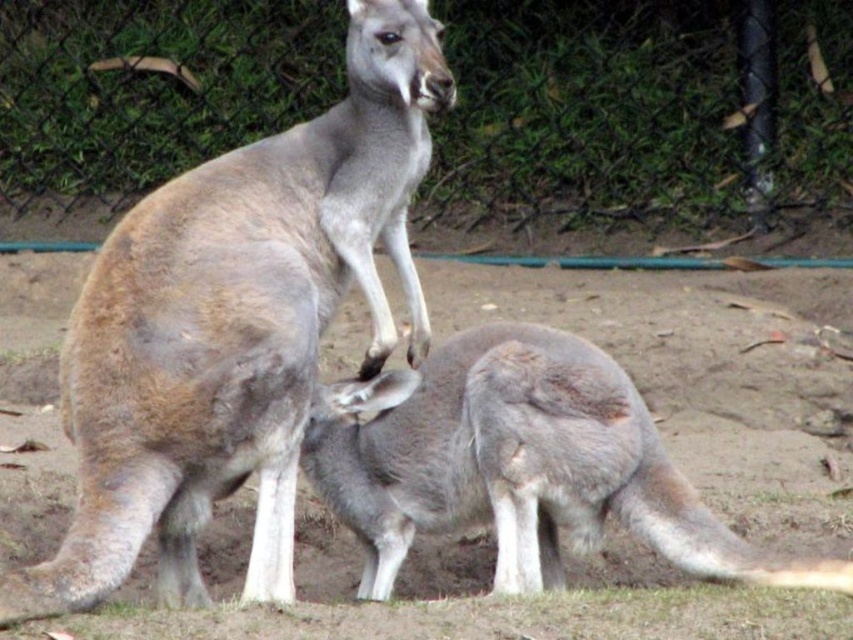
Can you confirm if gray fur kangaroo at center is positioned above gray fur kangaroo at lower center?

Correct, gray fur kangaroo at center is located above gray fur kangaroo at lower center.

Between gray fur kangaroo at center and gray fur kangaroo at lower center, which one is positioned lower?

gray fur kangaroo at lower center

Is point (216, 348) less distant than point (637, 516)?

Yes.

You are a GUI agent. You are given a task and a screenshot of the screen. Output one action in this format:
    pyautogui.click(x=<x>, y=<y>)
    Task: Click on the gray fur kangaroo at center
    This screenshot has height=640, width=853.
    Given the screenshot: What is the action you would take?
    pyautogui.click(x=235, y=324)